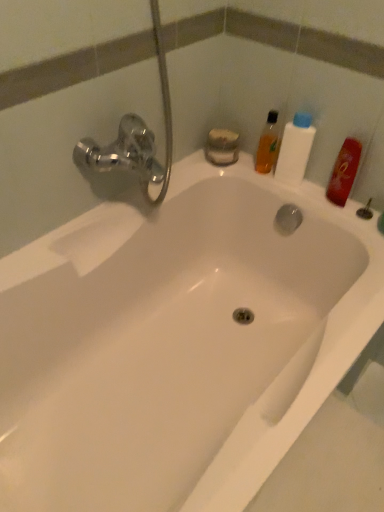
Identify the location of free space in front of red matte bottle at upper right, which appears as the 1th mouthwash when viewed from the right. (352, 223).